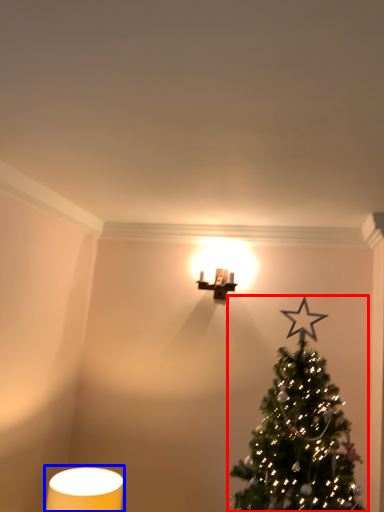
Question: Which object is further to the camera taking this photo, christmas tree (highlighted by a red box) or table lamp (highlighted by a blue box)?

Choices:
 (A) christmas tree
 (B) table lamp

Answer: (B)